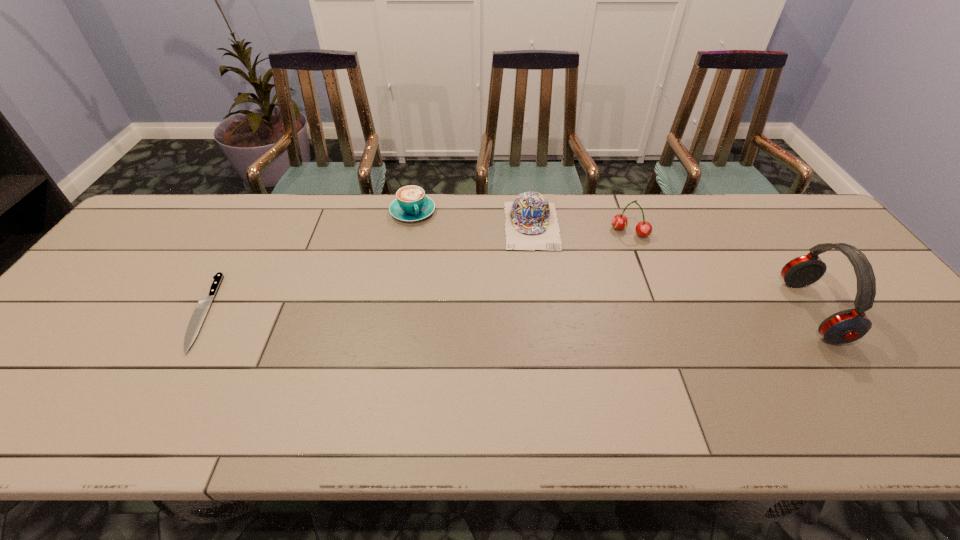
This screenshot has height=540, width=960. What are the coordinates of `the leftmost object` in the screenshot? It's located at (203, 305).

This screenshot has height=540, width=960. I want to click on steak knife, so click(203, 305).

Find the location of a particular element. earphone is located at coordinates (846, 326).

Identify the location of the rightmost object. (846, 326).

This screenshot has height=540, width=960. I want to click on the second tallest object, so click(x=619, y=221).

Identify the location of the second object from right to left. (619, 221).

This screenshot has height=540, width=960. Identify the location of cappuccino. (411, 204).

Where is `the third object from right to left`? This screenshot has width=960, height=540. the third object from right to left is located at coordinates (531, 222).

At what (x,y) coordinates should I click in order to perform the action: click on vacant space located 0.380m on the right of the steak knife. Please return your answer as a coordinate pair (x, y). Image resolution: width=960 pixels, height=540 pixels. Looking at the image, I should click on (364, 313).

Identify the location of vacant area situated on the ear cups of the rightmost object. This screenshot has height=540, width=960. (886, 311).